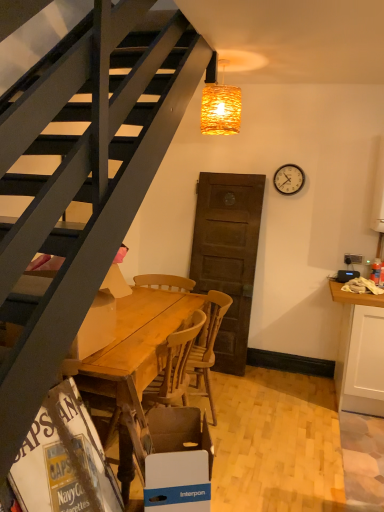
Question: Is white cardboard magazine at lower left oriented towards woven wicker lampshade at upper center?

Choices:
 (A) yes
 (B) no

Answer: (B)

Question: Are white cardboard magazine at lower left and woven wicker lampshade at upper center far apart?

Choices:
 (A) yes
 (B) no

Answer: (A)

Question: From a real-world perspective, is white cardboard magazine at lower left on woven wicker lampshade at upper center?

Choices:
 (A) no
 (B) yes

Answer: (A)

Question: Is white cardboard magazine at lower left thinner than woven wicker lampshade at upper center?

Choices:
 (A) no
 (B) yes

Answer: (A)

Question: Is white cardboard magazine at lower left bigger than woven wicker lampshade at upper center?

Choices:
 (A) no
 (B) yes

Answer: (B)

Question: In the image, is wooden table at center on the left side or the right side of wooden at center?

Choices:
 (A) right
 (B) left

Answer: (B)

Question: From their relative heights in the image, would you say wooden table at center is taller or shorter than wooden at center?

Choices:
 (A) tall
 (B) short

Answer: (B)

Question: Relative to wooden at center, is wooden table at center in front or behind?

Choices:
 (A) front
 (B) behind

Answer: (A)

Question: Considering the positions of wooden table at center and wooden at center in the image, is wooden table at center bigger or smaller than wooden at center?

Choices:
 (A) small
 (B) big

Answer: (A)

Question: Is point (110, 306) positioned closer to the camera than point (107, 490)?

Choices:
 (A) farther
 (B) closer

Answer: (A)

Question: From the image's perspective, is wooden table at lower left, the second box positioned from the right, positioned above or below white cardboard magazine at lower left?

Choices:
 (A) above
 (B) below

Answer: (A)

Question: Based on their sizes in the image, would you say wooden table at lower left, the second box positioned from the right, is bigger or smaller than white cardboard magazine at lower left?

Choices:
 (A) small
 (B) big

Answer: (B)

Question: Relative to white cardboard magazine at lower left, is wooden table at lower left, the first box in the top-to-bottom sequence, in front or behind?

Choices:
 (A) behind
 (B) front

Answer: (A)

Question: Is point (44, 289) closer or farther from the camera than point (160, 478)?

Choices:
 (A) farther
 (B) closer

Answer: (B)

Question: Relative to blue cardboard box at lower center, the 1th box from the bottom, is wooden table at lower left, marked as the first box in a left-to-right arrangement, in front or behind?

Choices:
 (A) front
 (B) behind

Answer: (B)